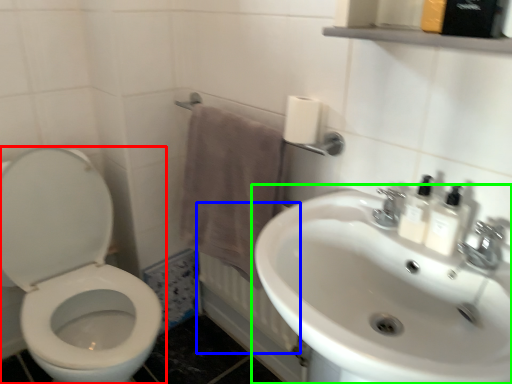
Question: Which object is the farthest from toilet (highlighted by a red box)? Choose among these: radiator (highlighted by a blue box) or sink (highlighted by a green box).

Choices:
 (A) radiator
 (B) sink

Answer: (B)